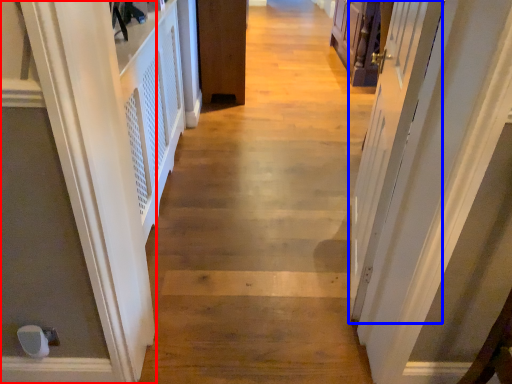
Question: Among these objects, which one is farthest to the camera, door (highlighted by a red box) or screen door (highlighted by a blue box)?

Choices:
 (A) door
 (B) screen door

Answer: (A)